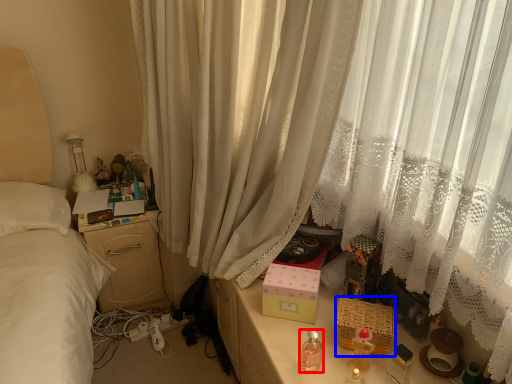
Question: Which of the following is the farthest to the observer, baby bottle (highlighted by a red box) or basket (highlighted by a blue box)?

Choices:
 (A) baby bottle
 (B) basket

Answer: (B)